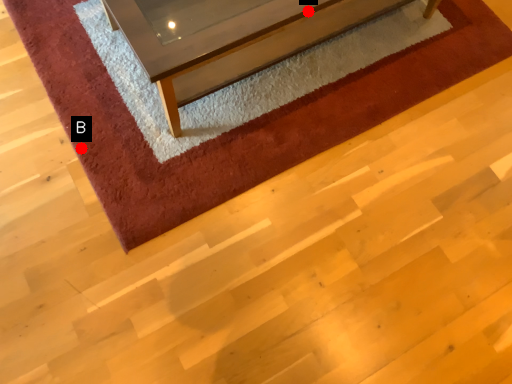
Question: Two points are circled on the image, labeled by A and B beside each circle. Which point is closer to the camera taking this photo?

Choices:
 (A) A is closer
 (B) B is closer

Answer: (A)